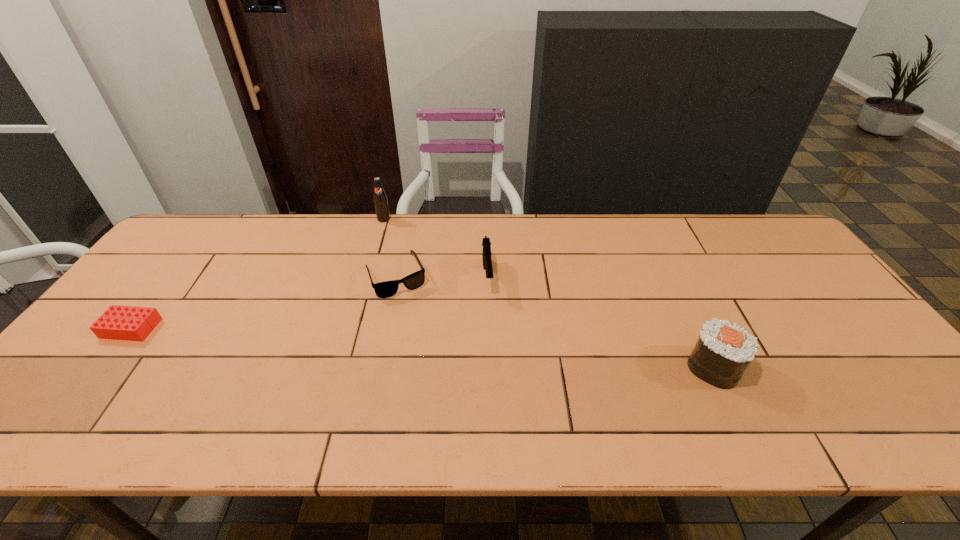
You are a GUI agent. You are given a task and a screenshot of the screen. Output one action in this format:
    pyautogui.click(x=<x>, y=<y>)
    Task: Click on the vacant space on the desktop that is between the shortest object and the sushi and is positioned on the front-facing side of the fourth tallest object
    
    Given the screenshot: What is the action you would take?
    pyautogui.click(x=432, y=348)

The width and height of the screenshot is (960, 540). I want to click on vacant space on the desktop that is between the leftmost object and the sushi and is positioned on the front label of the pop, so click(379, 345).

The width and height of the screenshot is (960, 540). Identify the location of free space on the desktop that is between the Lego and the sushi and is positioned on the front-facing side of the pistol. (495, 353).